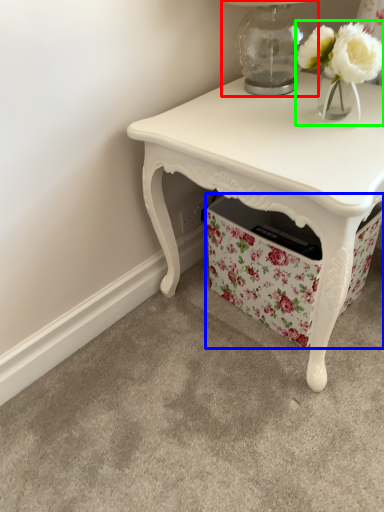
Question: Estimate the real-world distances between objects in this image. Which object is closer to table lamp (highlighted by a red box), storage box (highlighted by a blue box) or floral arrangement (highlighted by a green box)?

Choices:
 (A) storage box
 (B) floral arrangement

Answer: (B)